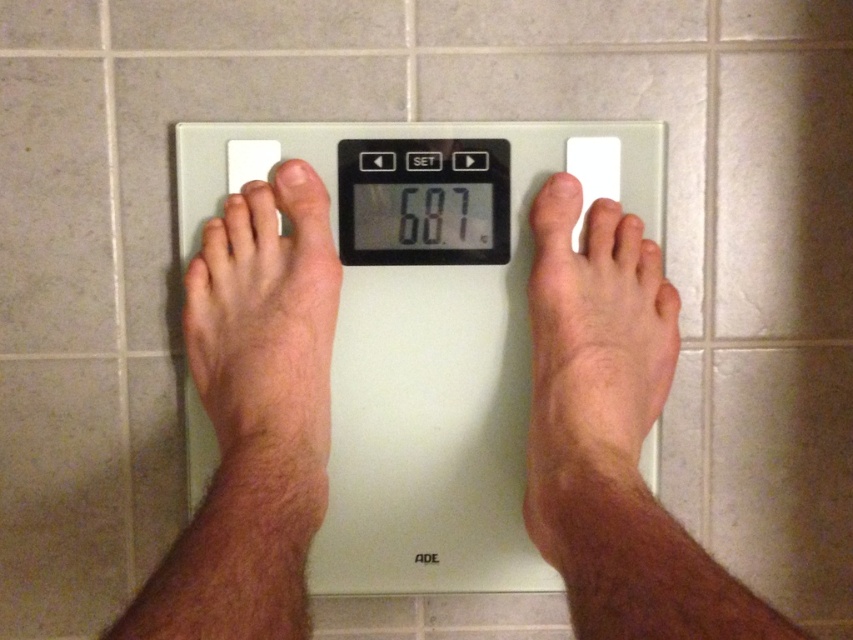
You are a physical therapist analyzing the standing posture of the person on the scale. You need to determine which of the two points, point (360, 148) or point (305, 326), is closer to you. Which one is it?

Point (360, 148) is further to the viewer than point (305, 326), so the point closer to you is point (305, 326).